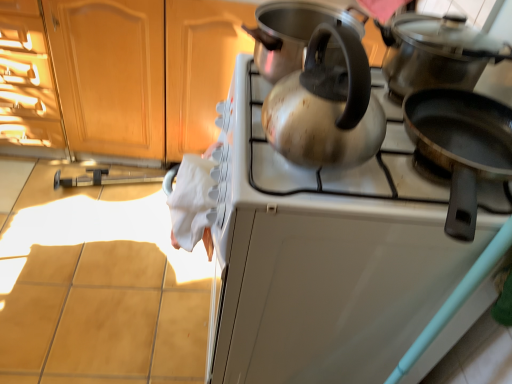
Question: Does satin silver kettle at upper center appear on the left side of satin silver kettle at center?

Choices:
 (A) no
 (B) yes

Answer: (A)

Question: Considering the relative sizes of satin silver kettle at upper center and satin silver kettle at center in the image provided, is satin silver kettle at upper center smaller than satin silver kettle at center?

Choices:
 (A) yes
 (B) no

Answer: (B)

Question: From the image's perspective, would you say satin silver kettle at upper center is shown under satin silver kettle at center?

Choices:
 (A) yes
 (B) no

Answer: (A)

Question: Considering the relative sizes of satin silver kettle at upper center and satin silver kettle at center in the image provided, is satin silver kettle at upper center wider than satin silver kettle at center?

Choices:
 (A) no
 (B) yes

Answer: (B)

Question: From a real-world perspective, is satin silver kettle at upper center physically below satin silver kettle at center?

Choices:
 (A) yes
 (B) no

Answer: (A)

Question: From a real-world perspective, relative to shiny metallic kettle at upper center, arranged as the 2th kitchen appliance when viewed from the top, is wooden cabinet at upper left vertically above or below?

Choices:
 (A) below
 (B) above

Answer: (A)

Question: Relative to shiny metallic kettle at upper center, placed as the 2th kitchen appliance when sorted from bottom to top, is wooden cabinet at upper left in front or behind?

Choices:
 (A) behind
 (B) front

Answer: (A)

Question: Based on their positions, is wooden cabinet at upper left located to the left or right of shiny metallic kettle at upper center, arranged as the 2th kitchen appliance when viewed from the top?

Choices:
 (A) left
 (B) right

Answer: (A)

Question: Considering the positions of point (209, 11) and point (301, 39), is point (209, 11) closer or farther from the camera than point (301, 39)?

Choices:
 (A) farther
 (B) closer

Answer: (A)

Question: Looking at their shapes, would you say black non-stick frying pan at right, which is counted as the 1th kitchen appliance, starting from the bottom, is wider or thinner than satin silver kettle at center?

Choices:
 (A) thin
 (B) wide

Answer: (B)

Question: Is point (410, 117) closer or farther from the camera than point (333, 100)?

Choices:
 (A) farther
 (B) closer

Answer: (A)

Question: From a real-world perspective, is black non-stick frying pan at right, which is counted as the 1th kitchen appliance, starting from the bottom, physically located above or below satin silver kettle at center?

Choices:
 (A) above
 (B) below

Answer: (B)

Question: In the image, is black non-stick frying pan at right, which is counted as the 1th kitchen appliance, starting from the bottom, on the left side or the right side of satin silver kettle at center?

Choices:
 (A) right
 (B) left

Answer: (A)

Question: Is satin silver kettle at center taller or shorter than satin silver kettle at upper center?

Choices:
 (A) tall
 (B) short

Answer: (B)

Question: Considering the relative positions of satin silver kettle at center and satin silver kettle at upper center in the image provided, is satin silver kettle at center to the left or to the right of satin silver kettle at upper center?

Choices:
 (A) left
 (B) right

Answer: (A)